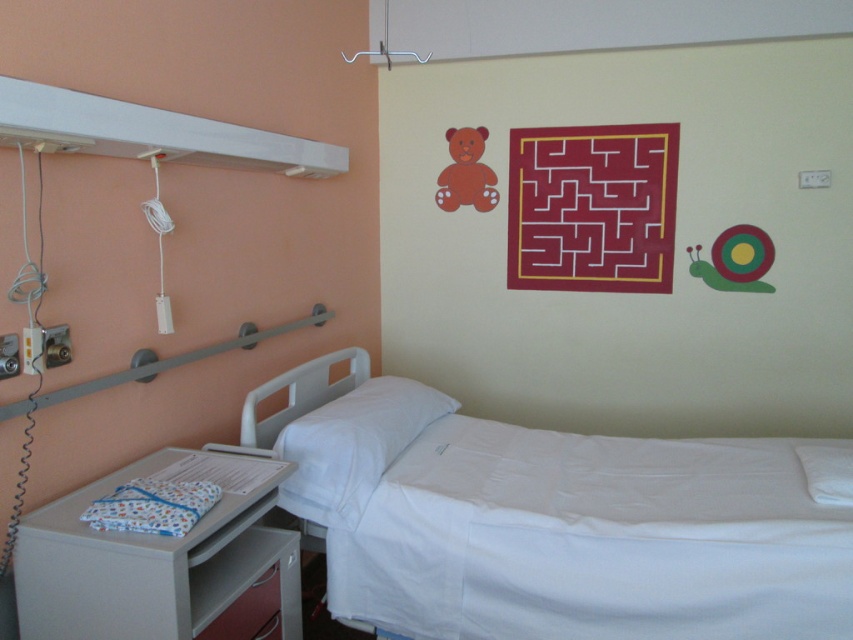
Who is taller, white smooth bed at center or white plastic tray at lower left?

white smooth bed at center

Does white smooth bed at center have a smaller size compared to white plastic tray at lower left?

No.

What do you see at coordinates (550, 520) in the screenshot? The image size is (853, 640). I see `white smooth bed at center` at bounding box center [550, 520].

The width and height of the screenshot is (853, 640). Identify the location of white smooth bed at center. (550, 520).